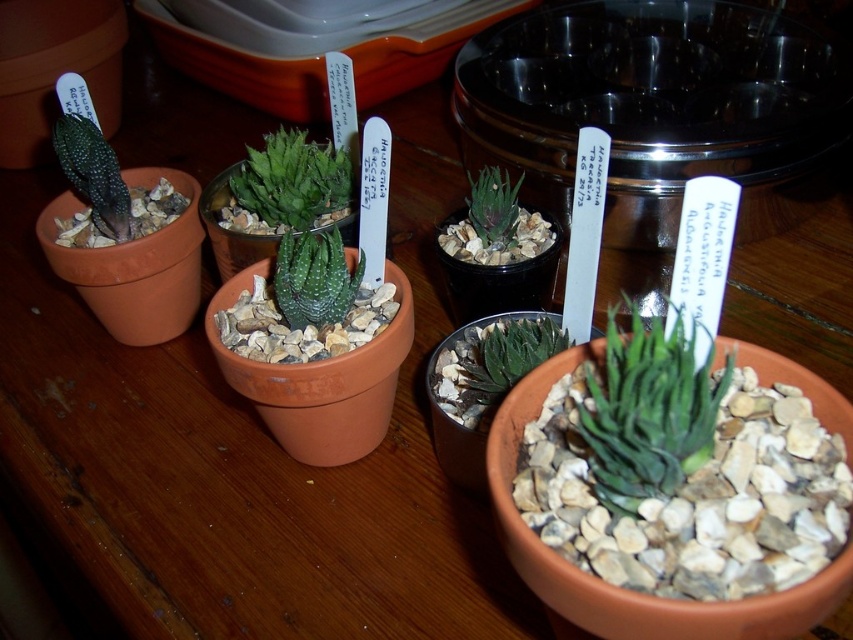
Is point (585, 436) positioned before point (270, 189)?

Yes, it is in front of point (270, 189).

Can you confirm if green matte succulent at center is positioned to the left of green succulent at center?

No, green matte succulent at center is not to the left of green succulent at center.

Is point (624, 381) closer to camera compared to point (296, 198)?

Yes.

At what (x,y) coordinates should I click in order to perform the action: click on green matte succulent at center. Please return your answer as a coordinate pair (x, y). The image size is (853, 640). Looking at the image, I should click on (648, 410).